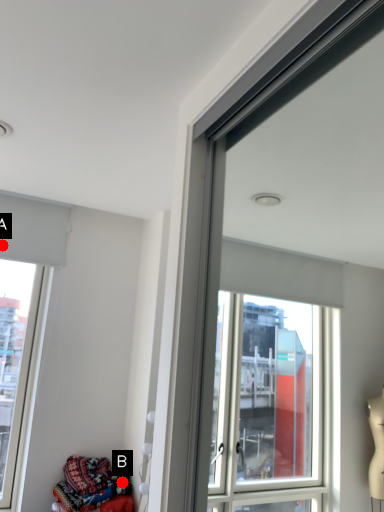
Question: Two points are circled on the image, labeled by A and B beside each circle. Among these points, which one is farthest from the camera?

Choices:
 (A) A is further
 (B) B is further

Answer: (A)